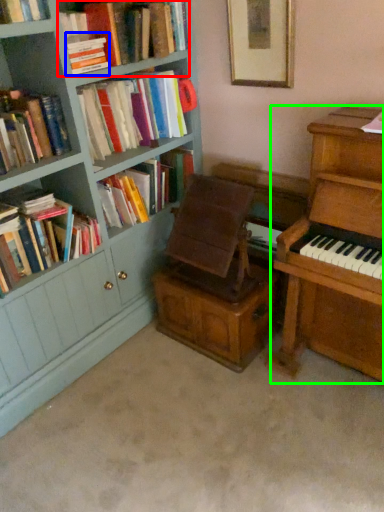
Question: Estimate the real-world distances between objects in this image. Which object is closer to book (highlighted by a red box), book (highlighted by a blue box) or piano (highlighted by a green box)?

Choices:
 (A) book
 (B) piano

Answer: (A)